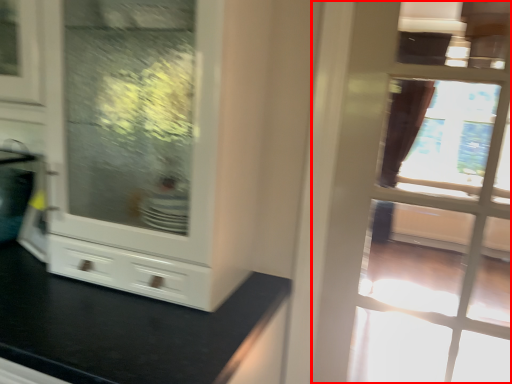
Question: From the image, what is the correct spatial relationship of door (annotated by the red box) in relation to cabinetry?

Choices:
 (A) left
 (B) right

Answer: (B)